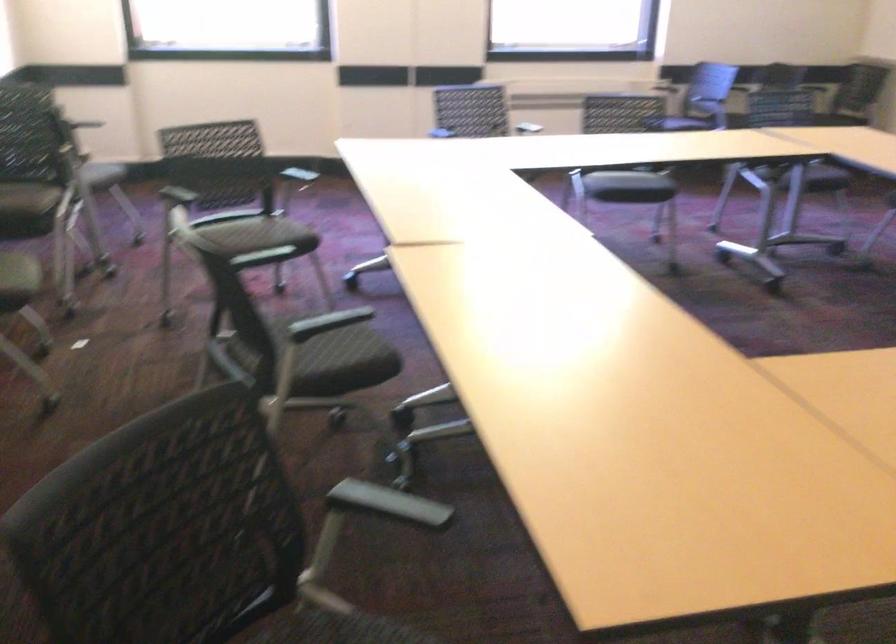
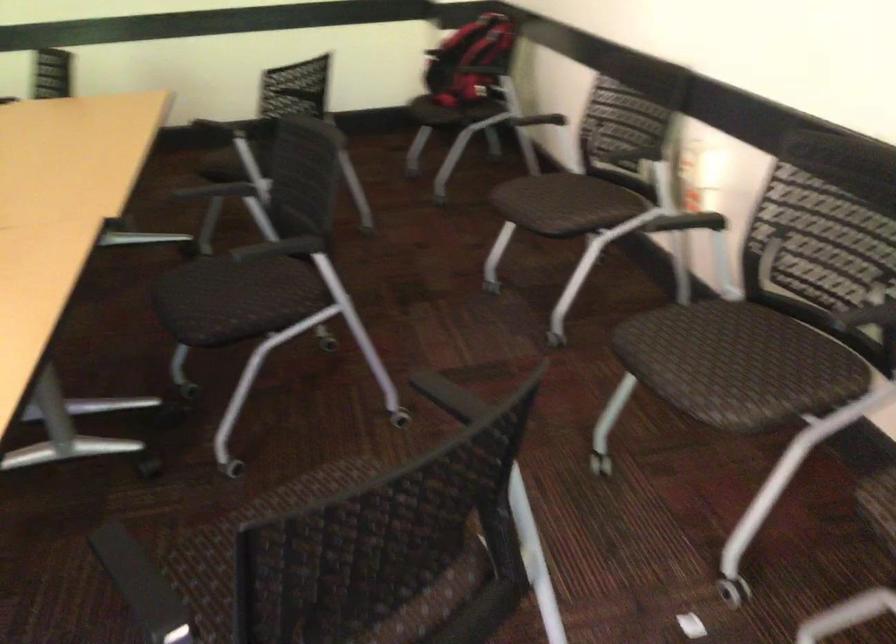
Locate, in the second image, the point that corresponds to point 268,250 in the first image.

(313, 487)